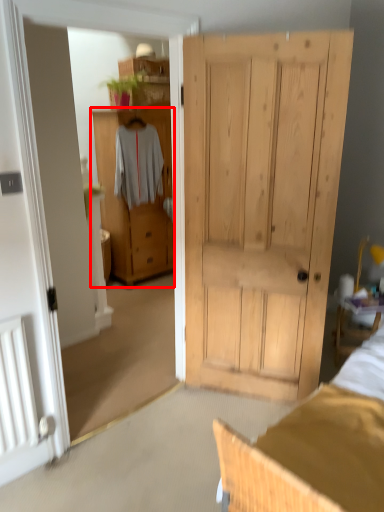
Question: From the image's perspective, where is cabinetry (annotated by the red box) located in relation to clothing in the image?

Choices:
 (A) above
 (B) below

Answer: (B)